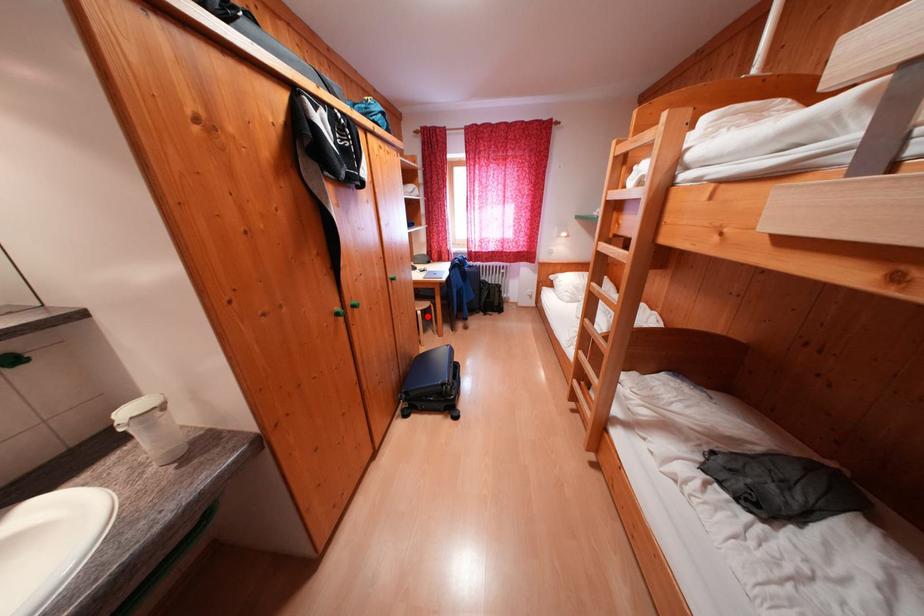
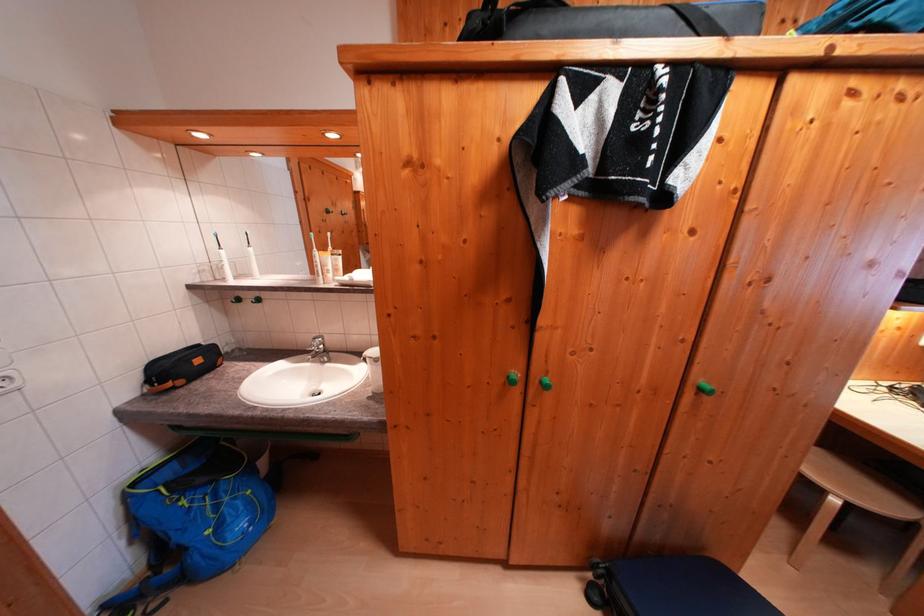
Question: I am providing you with two images of the same scene from different viewpoints. Given a red point in image1, look at the same physical point in image2. Is it:

Choices:
 (A) Closer to the viewpoint
 (B) Farther from the viewpoint

Answer: (A)